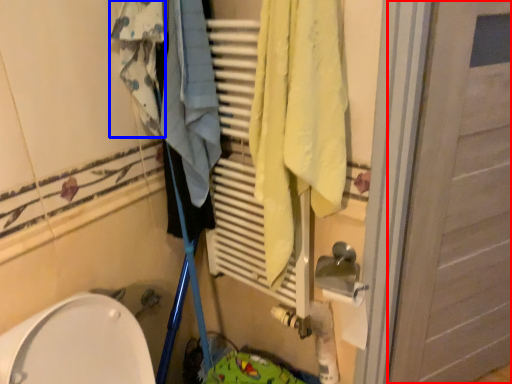
Question: Which of the following is the farthest to the observer, door (highlighted by a red box) or clothing (highlighted by a blue box)?

Choices:
 (A) door
 (B) clothing

Answer: (B)